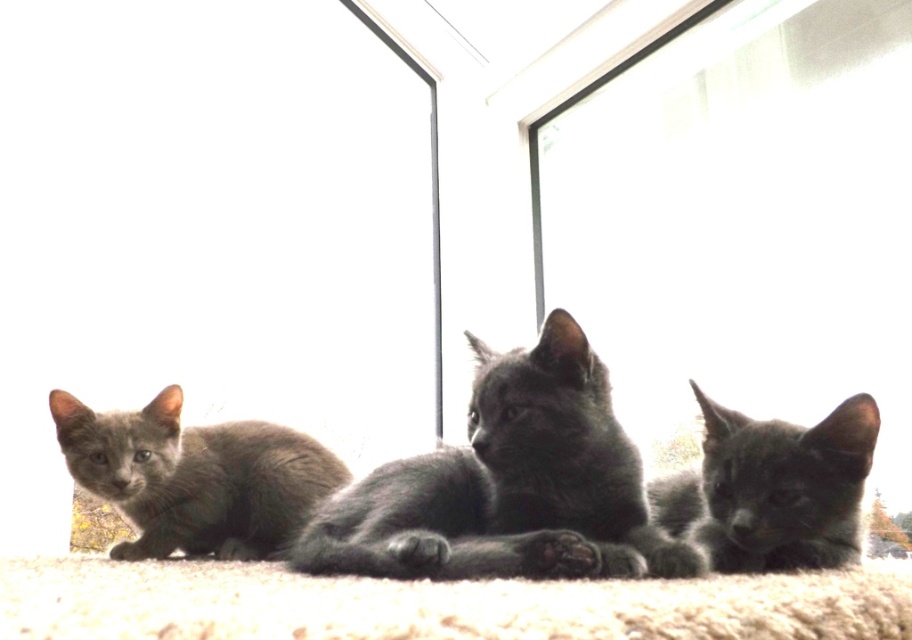
Does transparent glass window at upper center appear over soft gray fur cat at center?

Indeed, transparent glass window at upper center is positioned over soft gray fur cat at center.

Find the location of a particular element. The image size is (912, 640). transparent glass window at upper center is located at coordinates (745, 225).

Which of these two, transparent glass screen door at left or shiny black kitten at center, stands shorter?

shiny black kitten at center is shorter.

Does transparent glass screen door at left appear on the right side of shiny black kitten at center?

No, transparent glass screen door at left is not to the right of shiny black kitten at center.

Which is behind, point (30, 147) or point (814, 456)?

The point (30, 147) is behind.

Where is `transparent glass screen door at left`? This screenshot has height=640, width=912. transparent glass screen door at left is located at coordinates (208, 228).

Does transparent glass screen door at left have a smaller size compared to soft gray fur cat at center?

Incorrect, transparent glass screen door at left is not smaller in size than soft gray fur cat at center.

Is transparent glass screen door at left to the left of soft gray fur cat at center from the viewer's perspective?

Indeed, transparent glass screen door at left is positioned on the left side of soft gray fur cat at center.

Locate an element on the screen. The height and width of the screenshot is (640, 912). transparent glass screen door at left is located at coordinates tap(208, 228).